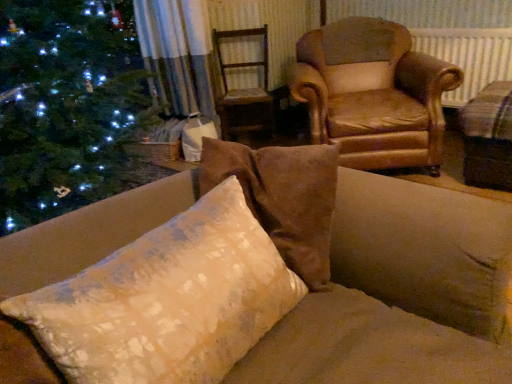
Question: Is wooden swivel chair at center wider or thinner than beige fabric cushion at right?

Choices:
 (A) thin
 (B) wide

Answer: (A)

Question: In terms of height, does wooden swivel chair at center look taller or shorter compared to beige fabric cushion at right?

Choices:
 (A) tall
 (B) short

Answer: (A)

Question: Estimate the real-world distances between objects in this image. Which object is farther from the white plastic radiator at upper right?

Choices:
 (A) textured cream pillow at center
 (B) leather armchair at upper right
 (C) beige fabric cushion at right
 (D) wooden swivel chair at center

Answer: (A)

Question: Based on their relative distances, which object is farther from the textured cream pillow at center?

Choices:
 (A) leather armchair at upper right
 (B) white plastic radiator at upper right
 (C) beige fabric cushion at right
 (D) wooden swivel chair at center

Answer: (B)